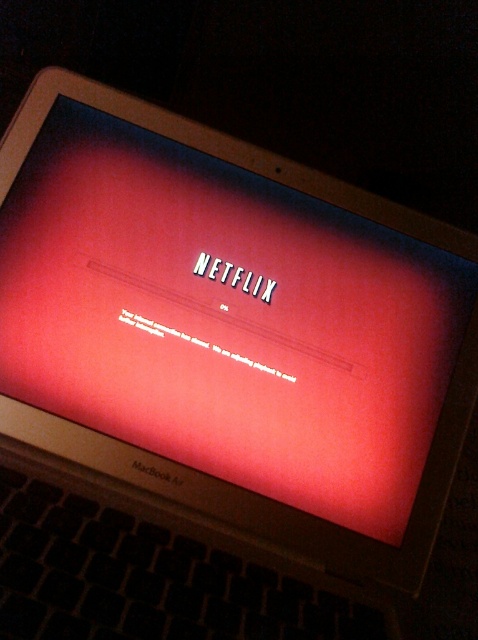
Question: Among these objects, which one is farthest from the camera?

Choices:
 (A) matte plastic computer screen at center
 (B) matte plastic netflix logo at center

Answer: (B)

Question: Can you confirm if matte plastic computer screen at center is positioned to the right of matte plastic netflix logo at center?

Choices:
 (A) no
 (B) yes

Answer: (A)

Question: Among these objects, which one is farthest from the camera?

Choices:
 (A) matte plastic netflix logo at center
 (B) matte plastic computer screen at center

Answer: (A)

Question: Is matte plastic computer screen at center to the left of matte plastic netflix logo at center from the viewer's perspective?

Choices:
 (A) no
 (B) yes

Answer: (B)

Question: Can you confirm if matte plastic computer screen at center is positioned above matte plastic netflix logo at center?

Choices:
 (A) no
 (B) yes

Answer: (A)